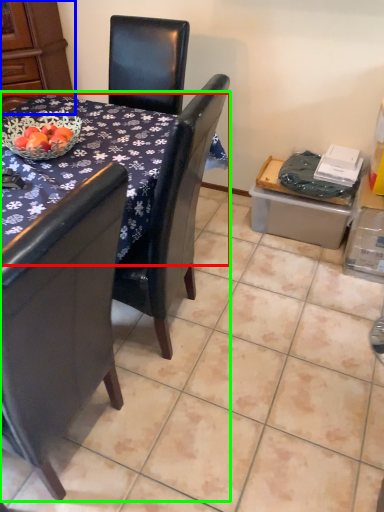
Question: Based on their relative distances, which object is farther from desk (highlighted by a red box)? Choose from armoire (highlighted by a blue box) and table (highlighted by a green box).

Choices:
 (A) armoire
 (B) table

Answer: (A)